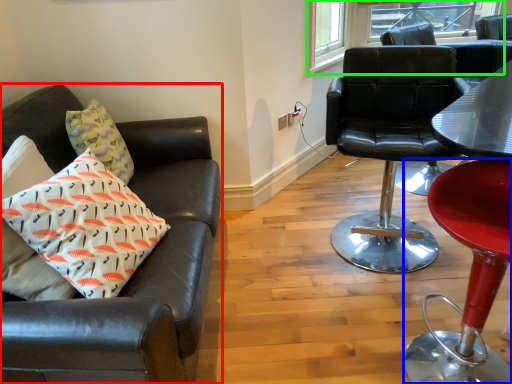
Question: Which object is positioned farthest from chair (highlighted by a red box)? Select from chair (highlighted by a blue box) and window (highlighted by a green box).

Choices:
 (A) chair
 (B) window

Answer: (B)